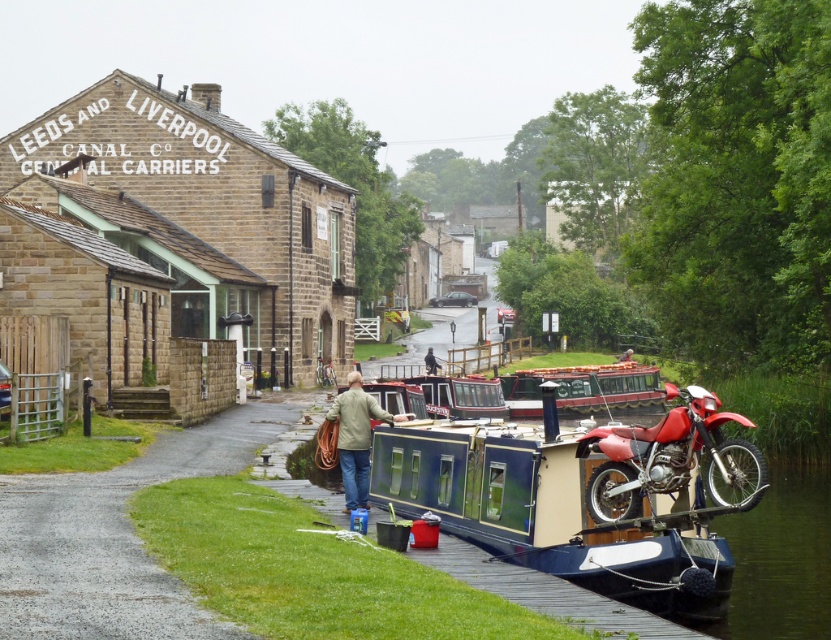
Which is more to the right, blue polished wood barge at center or light brown leather jacket at center?

From the viewer's perspective, blue polished wood barge at center appears more on the right side.

Which is in front, point (552, 531) or point (438, 365)?

Point (552, 531)

Does point (623, 564) come closer to viewer compared to point (431, 362)?

Yes, point (623, 564) is in front of point (431, 362).

Locate an element on the screen. The image size is (831, 640). blue polished wood barge at center is located at coordinates (542, 512).

From the picture: Between red matte motorcycle at right and light brown leather jacket at center, which one has more height?

red matte motorcycle at right is taller.

Does red matte motorcycle at right have a lesser width compared to light brown leather jacket at center?

Incorrect, red matte motorcycle at right's width is not less than light brown leather jacket at center's.

Find the location of `red matte motorcycle at right`. red matte motorcycle at right is located at coordinates (672, 460).

Looking at this image, which is more to the left, red matte motorcycle at right or silver metallic bicycle at center?

From the viewer's perspective, silver metallic bicycle at center appears more on the left side.

Does red matte motorcycle at right have a smaller size compared to silver metallic bicycle at center?

Actually, red matte motorcycle at right might be larger than silver metallic bicycle at center.

What do you see at coordinates (672, 460) in the screenshot? The width and height of the screenshot is (831, 640). I see `red matte motorcycle at right` at bounding box center [672, 460].

You are a GUI agent. You are given a task and a screenshot of the screen. Output one action in this format:
    pyautogui.click(x=<x>, y=<y>)
    Task: Click on the red matte motorcycle at right
    
    Given the screenshot: What is the action you would take?
    pyautogui.click(x=672, y=460)